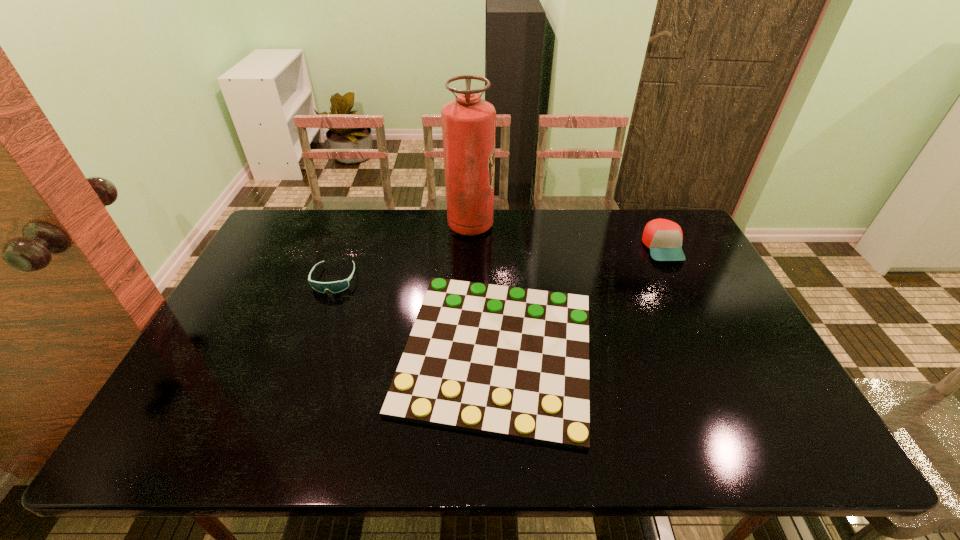
Identify the location of unoccupied position between the leftmost object and the rightmost object. This screenshot has height=540, width=960. (498, 264).

At what (x,y) coordinates should I click in order to perform the action: click on vacant space in between the tallest object and the rightmost object. Please return your answer as a coordinate pair (x, y). This screenshot has width=960, height=540. Looking at the image, I should click on (566, 237).

Where is `free space between the tallest object and the goggles`? Image resolution: width=960 pixels, height=540 pixels. free space between the tallest object and the goggles is located at coordinates (402, 253).

Where is `unoccupied area between the checkerboard and the leftmost object`? unoccupied area between the checkerboard and the leftmost object is located at coordinates (416, 315).

You are a GUI agent. You are given a task and a screenshot of the screen. Output one action in this format:
    pyautogui.click(x=<x>, y=<y>)
    Task: Click on the free point between the third tallest object and the fire extinguisher
    
    Given the screenshot: What is the action you would take?
    pyautogui.click(x=402, y=253)

This screenshot has width=960, height=540. Find the location of `empty space that is in between the fire extinguisher and the baseball cap`. empty space that is in between the fire extinguisher and the baseball cap is located at coordinates (566, 237).

Locate which object ranks second in proximity to the tallest object. Please provide its 2D coordinates. Your answer should be formatted as a tuple, i.e. [(x, y)], where the tuple contains the x and y coordinates of a point satisfying the conditions above.

[(337, 286)]

In order to click on object that ranks as the second closest to the second shortest object in this screenshot , I will do `click(468, 123)`.

What are the coordinates of `vacant area that satisfies the following two spatial constraints: 1. on the label side of the checkerboard; 2. on the right side of the tallest object` in the screenshot? It's located at (467, 352).

You are a GUI agent. You are given a task and a screenshot of the screen. Output one action in this format:
    pyautogui.click(x=<x>, y=<y>)
    Task: Click on the vacant space that satisfies the following two spatial constraints: 1. on the label side of the checkerboard; 2. on the right side of the fire extinguisher
    This screenshot has height=540, width=960.
    Given the screenshot: What is the action you would take?
    pyautogui.click(x=467, y=352)